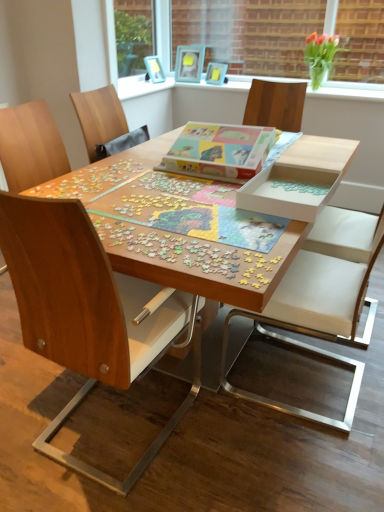
Locate an element on the screen. empty space that is ontop of wooden puzzle at center (from a real-world perspective) is located at coordinates (181, 185).